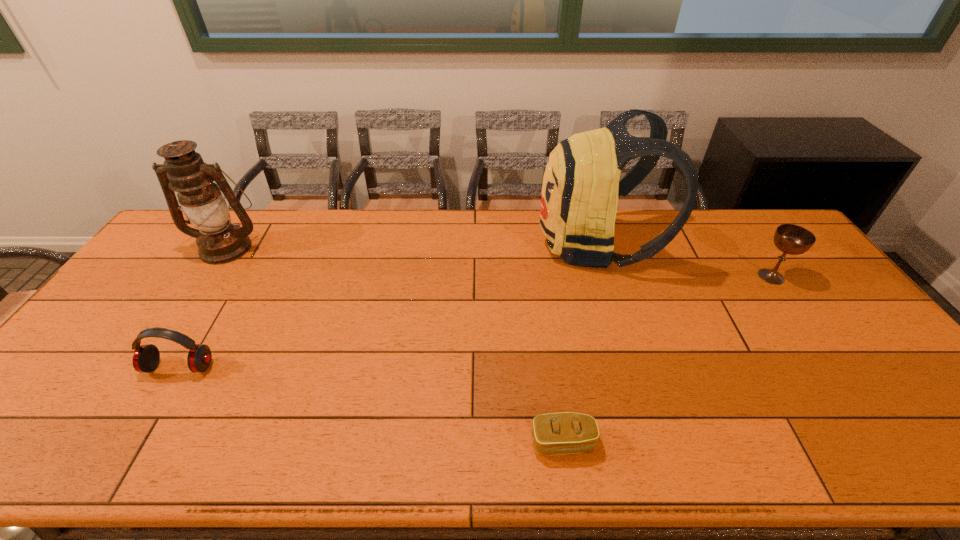
At what (x,y) coordinates should I click in order to perform the action: click on backpack. Please return your answer as a coordinate pair (x, y). Image resolution: width=960 pixels, height=540 pixels. Looking at the image, I should click on (579, 199).

The image size is (960, 540). What are the coordinates of `lantern` in the screenshot? It's located at (219, 241).

Where is `the rightmost object`? Image resolution: width=960 pixels, height=540 pixels. the rightmost object is located at coordinates pyautogui.click(x=791, y=239).

Identify the location of chalice. The image size is (960, 540). (791, 239).

Identify the location of earphone. The image size is (960, 540). (146, 358).

Locate an element on the screen. the second shortest object is located at coordinates (146, 358).

What are the coordinates of `the nearest object` in the screenshot? It's located at (561, 433).

You are a GUI agent. You are given a task and a screenshot of the screen. Output one action in this format:
    pyautogui.click(x=<x>, y=<y>)
    Task: Click on the clutch bag
    
    Given the screenshot: What is the action you would take?
    pyautogui.click(x=561, y=433)

This screenshot has height=540, width=960. What are the coordinates of `free space located 0.080m on the front-facing side of the backpack` in the screenshot? It's located at (513, 244).

The height and width of the screenshot is (540, 960). Identify the location of vacant region located on the front-facing side of the backpack. (494, 244).